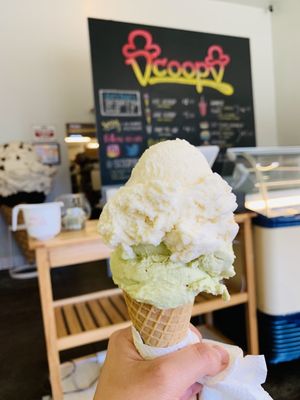
Find the location of `wall`. wall is located at coordinates (268, 18).